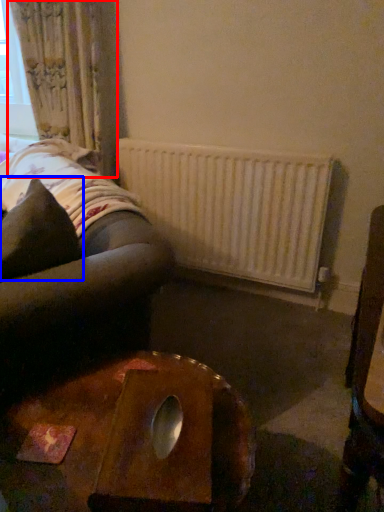
Question: Which object is further to the camera taking this photo, curtain (highlighted by a red box) or throw pillow (highlighted by a blue box)?

Choices:
 (A) curtain
 (B) throw pillow

Answer: (A)